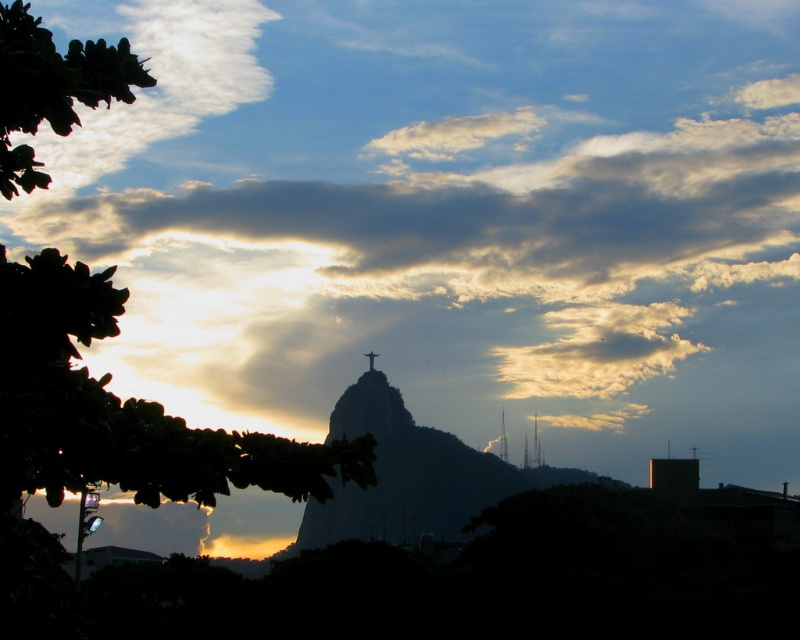
Question: Which point appears farthest from the camera in this image?

Choices:
 (A) pyautogui.click(x=236, y=477)
 (B) pyautogui.click(x=130, y=131)

Answer: (B)

Question: Which object is closer to the camera taking this photo?

Choices:
 (A) green leafy tree at left
 (B) green leafy tree at upper left
 (C) cloudy sky at upper center
 (D) silvery metallic statue at center

Answer: (B)

Question: Can you confirm if green leafy tree at left is smaller than white fluffy cloud at upper left?

Choices:
 (A) yes
 (B) no

Answer: (B)

Question: Is white fluffy cloud at upper left further to the viewer compared to metallic spire at upper center?

Choices:
 (A) yes
 (B) no

Answer: (B)

Question: Estimate the real-world distances between objects in this image. Which object is farther from the cloudy sky at upper center?

Choices:
 (A) silvery metallic statue at center
 (B) metallic gold cross at center
 (C) metallic spire at upper center

Answer: (C)

Question: Can you confirm if green leafy tree at left is wider than metallic gold cross at center?

Choices:
 (A) yes
 (B) no

Answer: (A)